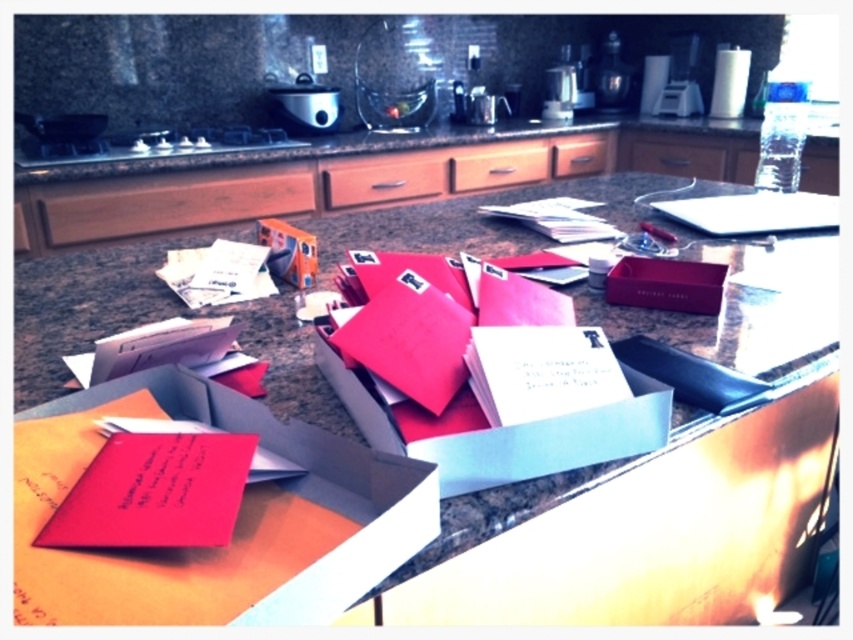
You are standing at the edge of the kitchen countertop and want to reach both the point at coordinates point (634,308) and point (26,600). Which point is closer to you?

Point (26,600) is closer to you because it is less further to the viewer than point (634,308).

Looking at this image, you are organizing mail on the cluttered kitchen countertop and need to determine which item takes up more vertical space. Which is taller, the matte paper envelope at center or the matte cardboard box at center?

The matte paper envelope at center is much taller than the matte cardboard box at center according to the description.

You are organizing mail in a busy kitchen. You have two boxes on the counter, a matte paper box at center and a matte cardboard box at center. Which box is positioned to the left of the other?

The matte paper box at center is to the left of the matte cardboard box at center.